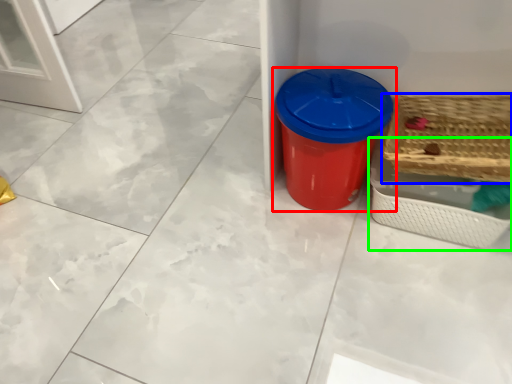
Question: Which is nearer to the waste container (highlighted by a red box)? basket (highlighted by a blue box) or basket (highlighted by a green box).

Choices:
 (A) basket
 (B) basket

Answer: (B)